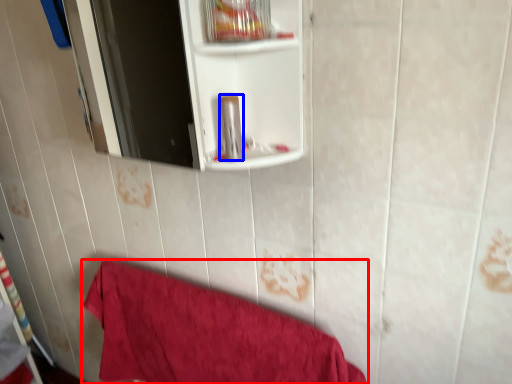
Question: Which object is further to the camera taking this photo, towel (highlighted by a red box) or toiletry (highlighted by a blue box)?

Choices:
 (A) towel
 (B) toiletry

Answer: (A)